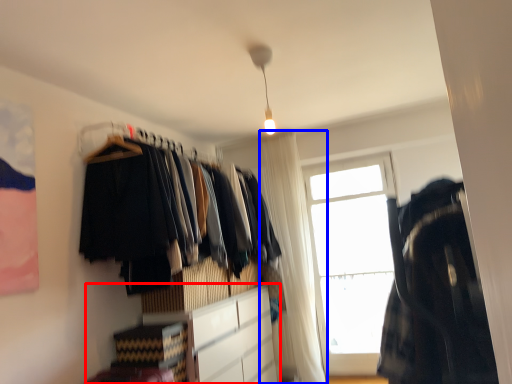
Question: Which object is further to the camera taking this photo, cabinetry (highlighted by a red box) or curtain (highlighted by a blue box)?

Choices:
 (A) cabinetry
 (B) curtain

Answer: (B)